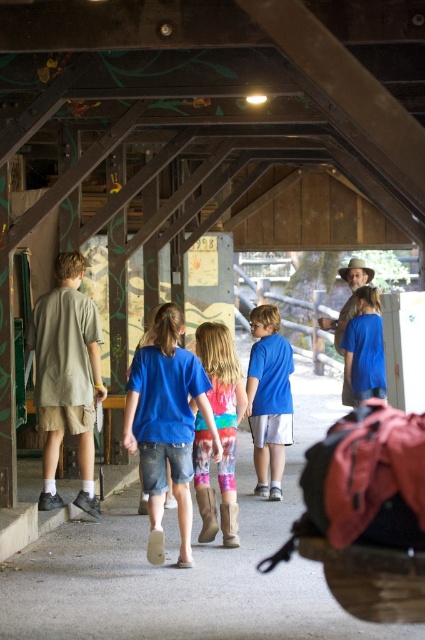
Question: Does blue denim shorts at center appear on the right side of tie-dye fabric leggings at center?

Choices:
 (A) no
 (B) yes

Answer: (A)

Question: Is blue denim shorts at center below blue t-shirt at center?

Choices:
 (A) no
 (B) yes

Answer: (B)

Question: Which point is farther to the camera?

Choices:
 (A) (198, 499)
 (B) (274, 394)

Answer: (B)

Question: Among these objects, which one is nearest to the camera?

Choices:
 (A) blue t-shirt at center
 (B) tie-dye fabric leggings at center
 (C) blue denim shorts at center
 (D) matte blue shirt at center

Answer: (C)

Question: Does blue denim shorts at center have a smaller size compared to tie-dye fabric leggings at center?

Choices:
 (A) no
 (B) yes

Answer: (A)

Question: Which is farther from the blue t-shirt at center?

Choices:
 (A) blue denim shorts at center
 (B) matte blue shirt at center

Answer: (A)